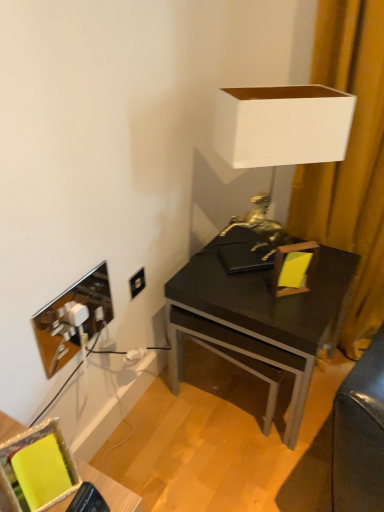
Question: Is point (241, 283) positioned closer to the camera than point (360, 74)?

Choices:
 (A) closer
 (B) farther

Answer: (B)

Question: Relative to yellow fabric curtain at right, is matte black desk at center in front or behind?

Choices:
 (A) front
 (B) behind

Answer: (B)

Question: Which object is the closest to the yellow fabric picture frame at lower left, positioned as the 1th picture frame in front-to-back order?

Choices:
 (A) matte black desk at center
 (B) yellow fabric curtain at right
 (C) metallic reflective picture frame at lower left, the 1th picture frame when ordered from top to bottom
 (D) black plastic power outlet at lower left
 (E) black matte drawer at center

Answer: (C)

Question: Based on their relative distances, which object is nearer to the black plastic power outlet at lower left?

Choices:
 (A) yellow fabric picture frame at lower left, which is counted as the 1th picture frame, starting from the bottom
 (B) white matte lampshade at upper right
 (C) black matte drawer at center
 (D) metallic reflective picture frame at lower left, the second picture frame from the front
 (E) yellow fabric curtain at right

Answer: (D)